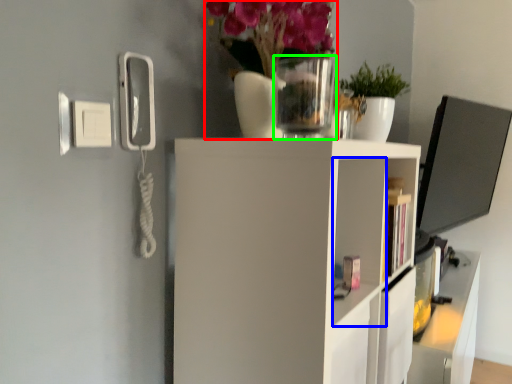
Question: Which object is positioned closest to floral arrangement (highlighted by a red box)? Select from cabinet (highlighted by a blue box) and glass vase (highlighted by a green box).

Choices:
 (A) cabinet
 (B) glass vase

Answer: (B)